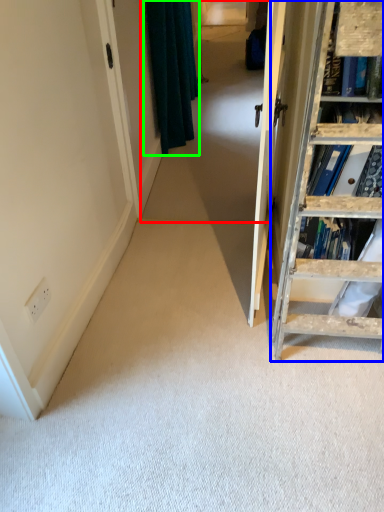
Question: Based on their relative distances, which object is nearer to passage (highlighted by a red box)? Choose from ladder (highlighted by a blue box) and curtain (highlighted by a green box).

Choices:
 (A) ladder
 (B) curtain

Answer: (B)